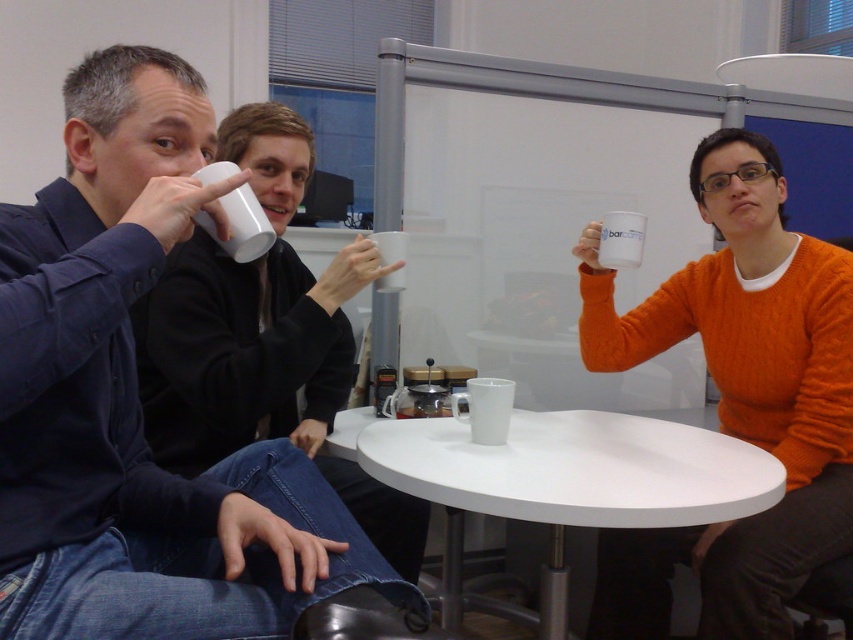
Is matte orange sweater at right positioned behind white matte mug at upper right?

No, it is in front of white matte mug at upper right.

This screenshot has height=640, width=853. I want to click on matte orange sweater at right, so click(x=264, y=340).

Who is more distant from viewer, (163, 410) or (608, 212)?

The point (608, 212) is behind.

Locate an element on the screen. This screenshot has width=853, height=640. matte orange sweater at right is located at coordinates (264, 340).

I want to click on matte orange sweater at right, so click(x=264, y=340).

The image size is (853, 640). What do you see at coordinates (264, 340) in the screenshot?
I see `matte orange sweater at right` at bounding box center [264, 340].

Locate an element on the screen. matte orange sweater at right is located at coordinates (264, 340).

Is white matte mug at upper center to the right of white matte mug at center from the viewer's perspective?

In fact, white matte mug at upper center is to the left of white matte mug at center.

Does white matte mug at upper center appear on the left side of white matte mug at center?

Correct, you'll find white matte mug at upper center to the left of white matte mug at center.

Who is more distant from viewer, (224, 196) or (383, 234)?

Positioned behind is point (383, 234).

I want to click on white matte mug at upper center, so click(x=241, y=225).